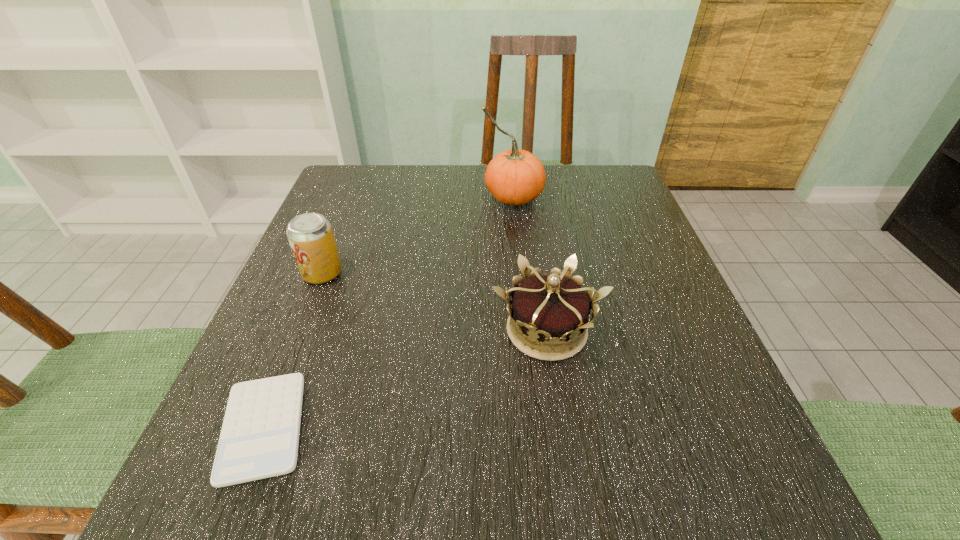
Identify the location of empty space that is in between the crown and the pumpkin. The image size is (960, 540). (530, 264).

At what (x,y) coordinates should I click in order to perform the action: click on free space between the pop (soda) and the calculator. Please return your answer as a coordinate pair (x, y). This screenshot has width=960, height=540. Looking at the image, I should click on (293, 350).

This screenshot has width=960, height=540. I want to click on empty location between the shortest object and the second nearest object, so click(405, 379).

Locate which object ranks third in proximity to the third farthest object. Please provide its 2D coordinates. Your answer should be formatted as a tuple, i.e. [(x, y)], where the tuple contains the x and y coordinates of a point satisfying the conditions above.

[(310, 235)]

Identify which object is the third nearest to the second farthest object. Please provide its 2D coordinates. Your answer should be formatted as a tuple, i.e. [(x, y)], where the tuple contains the x and y coordinates of a point satisfying the conditions above.

[(515, 177)]

The width and height of the screenshot is (960, 540). What are the coordinates of `free point that satisfies the following two spatial constraints: 1. on the back side of the second nearest object; 2. on the right side of the nearest object` in the screenshot? It's located at (301, 330).

Identify the location of vacant area in the image that satisfies the following two spatial constraints: 1. on the back side of the crown; 2. on the right side of the calculator. This screenshot has width=960, height=540. (301, 330).

Where is `vacant position in the image that satisfies the following two spatial constraints: 1. on the back side of the calculator; 2. on the left side of the tallest object`? This screenshot has height=540, width=960. vacant position in the image that satisfies the following two spatial constraints: 1. on the back side of the calculator; 2. on the left side of the tallest object is located at coordinates (354, 197).